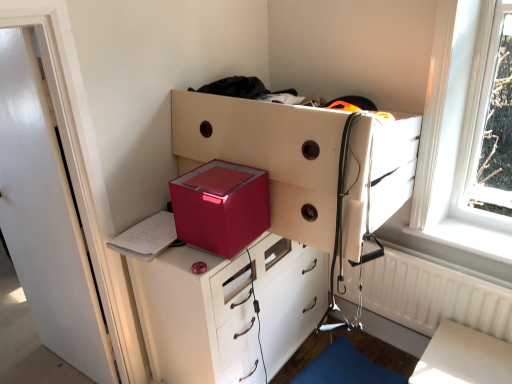
Question: Is metallic pink cube at center positioned before blue fabric step stool at lower right?

Choices:
 (A) yes
 (B) no

Answer: (A)

Question: Is the depth of metallic pink cube at center greater than that of blue fabric step stool at lower right?

Choices:
 (A) no
 (B) yes

Answer: (A)

Question: From the image's perspective, is metallic pink cube at center on blue fabric step stool at lower right?

Choices:
 (A) no
 (B) yes

Answer: (B)

Question: Is metallic pink cube at center facing away from blue fabric step stool at lower right?

Choices:
 (A) no
 (B) yes

Answer: (A)

Question: Considering the relative sizes of metallic pink cube at center and blue fabric step stool at lower right in the image provided, is metallic pink cube at center bigger than blue fabric step stool at lower right?

Choices:
 (A) yes
 (B) no

Answer: (B)

Question: Considering the relative positions of metallic white chest of drawers at center, which is the first chest of drawers in top-to-bottom order, and metallic red chest of drawers at center, the first chest of drawers when ordered from bottom to top, in the image provided, is metallic white chest of drawers at center, which is the first chest of drawers in top-to-bottom order, to the left or to the right of metallic red chest of drawers at center, the first chest of drawers when ordered from bottom to top,?

Choices:
 (A) right
 (B) left

Answer: (A)

Question: Is metallic white chest of drawers at center, which is the first chest of drawers in top-to-bottom order, situated inside metallic red chest of drawers at center, the 2th chest of drawers in the top-to-bottom sequence, or outside?

Choices:
 (A) inside
 (B) outside

Answer: (B)

Question: Based on their sizes in the image, would you say metallic white chest of drawers at center, which appears as the second chest of drawers when ordered from the bottom, is bigger or smaller than metallic red chest of drawers at center, the 2th chest of drawers in the top-to-bottom sequence?

Choices:
 (A) small
 (B) big

Answer: (A)

Question: From a real-world perspective, relative to metallic red chest of drawers at center, the 2th chest of drawers in the top-to-bottom sequence, is metallic white chest of drawers at center, which appears as the second chest of drawers when ordered from the bottom, vertically above or below?

Choices:
 (A) below
 (B) above

Answer: (B)

Question: Do you think white glossy door at left is within white textured radiator at right, or outside of it?

Choices:
 (A) outside
 (B) inside

Answer: (A)

Question: Relative to white textured radiator at right, is white glossy door at left in front or behind?

Choices:
 (A) behind
 (B) front

Answer: (B)

Question: From their relative heights in the image, would you say white glossy door at left is taller or shorter than white textured radiator at right?

Choices:
 (A) short
 (B) tall

Answer: (B)

Question: From a real-world perspective, is white glossy door at left positioned above or below white textured radiator at right?

Choices:
 (A) below
 (B) above

Answer: (B)

Question: From the image's perspective, is white textured radiator at right above or below metallic white chest of drawers at center, which appears as the second chest of drawers when ordered from the bottom?

Choices:
 (A) above
 (B) below

Answer: (B)

Question: Visually, is white textured radiator at right positioned to the left or to the right of metallic white chest of drawers at center, which appears as the second chest of drawers when ordered from the bottom?

Choices:
 (A) left
 (B) right

Answer: (B)